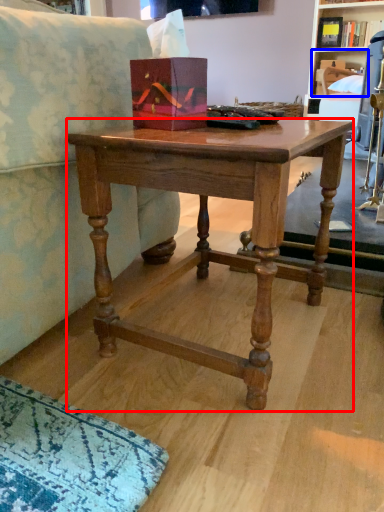
Question: Which of the following is the farthest to the observer, desk (highlighted by a red box) or shelf (highlighted by a blue box)?

Choices:
 (A) desk
 (B) shelf

Answer: (B)